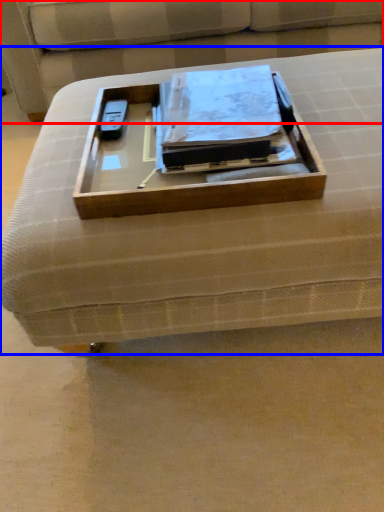
Question: Among these objects, which one is nearest to the camera, couch (highlighted by a red box) or furniture (highlighted by a blue box)?

Choices:
 (A) couch
 (B) furniture

Answer: (B)